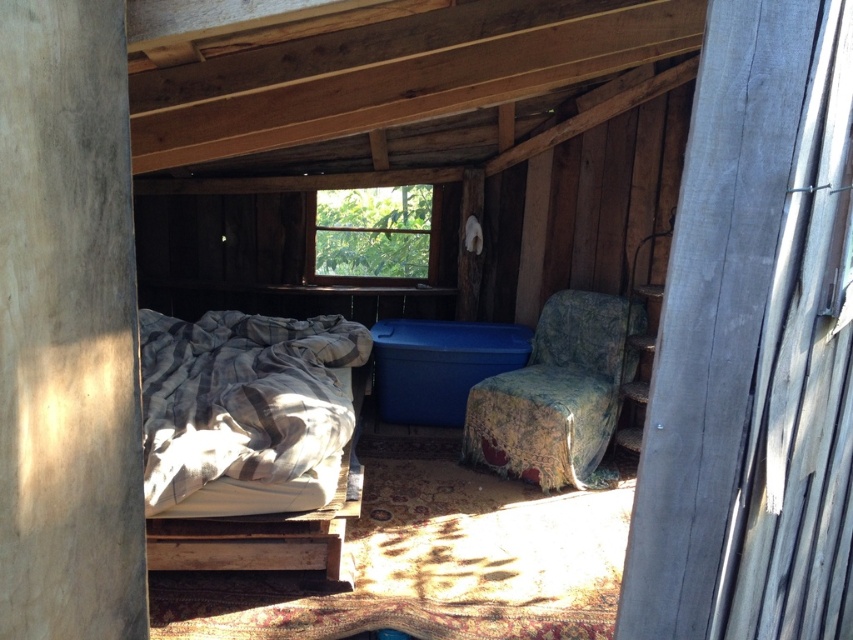
Describe the element at coordinates (250, 440) in the screenshot. I see `plaid fabric bed at left` at that location.

Measure the distance between plaid fabric bed at left and camera.

plaid fabric bed at left is 2.47 meters away from camera.

Locate an element on the screen. This screenshot has width=853, height=640. plaid fabric bed at left is located at coordinates (250, 440).